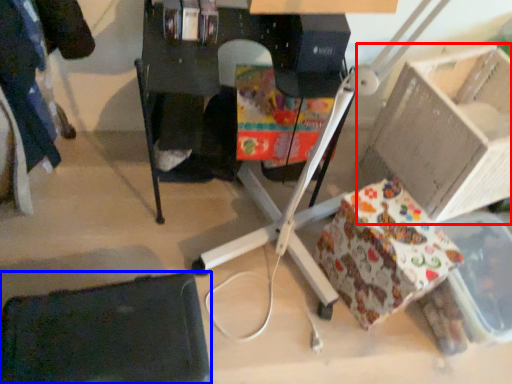
Question: Which object is closer to the camera taking this photo, cardboard box (highlighted by a red box) or swivel chair (highlighted by a blue box)?

Choices:
 (A) cardboard box
 (B) swivel chair

Answer: (B)